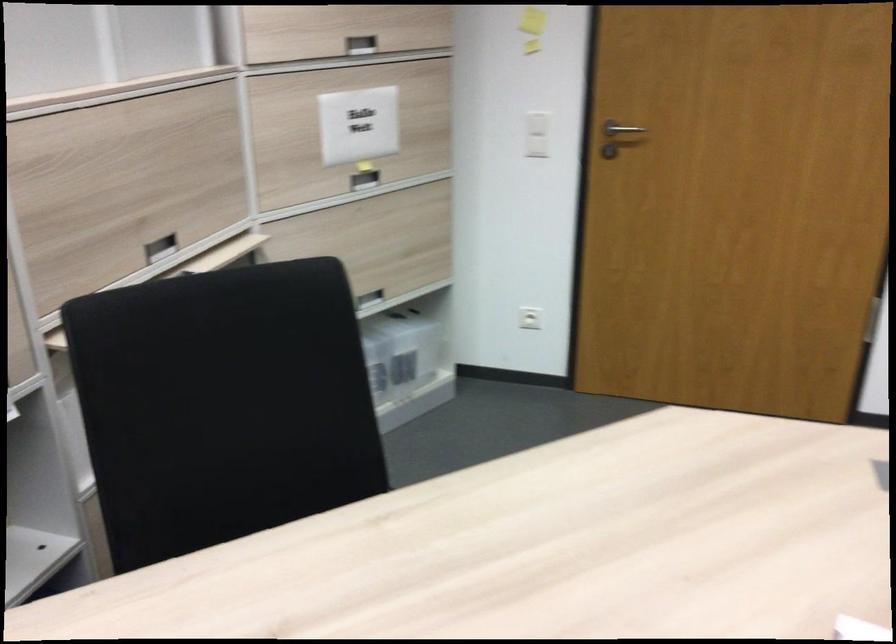
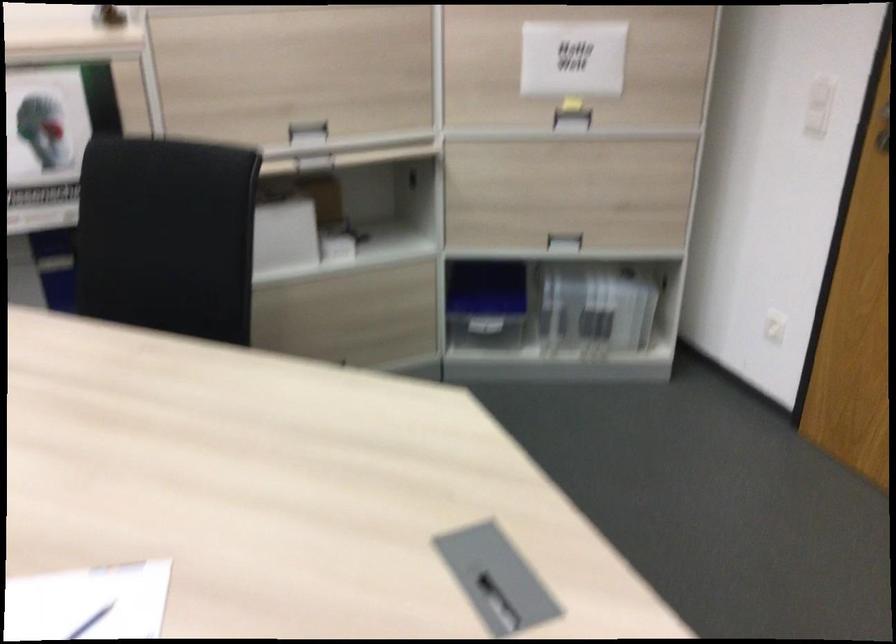
Find the pixel in the second image that matches pixel 416 352 in the first image.

(596, 308)